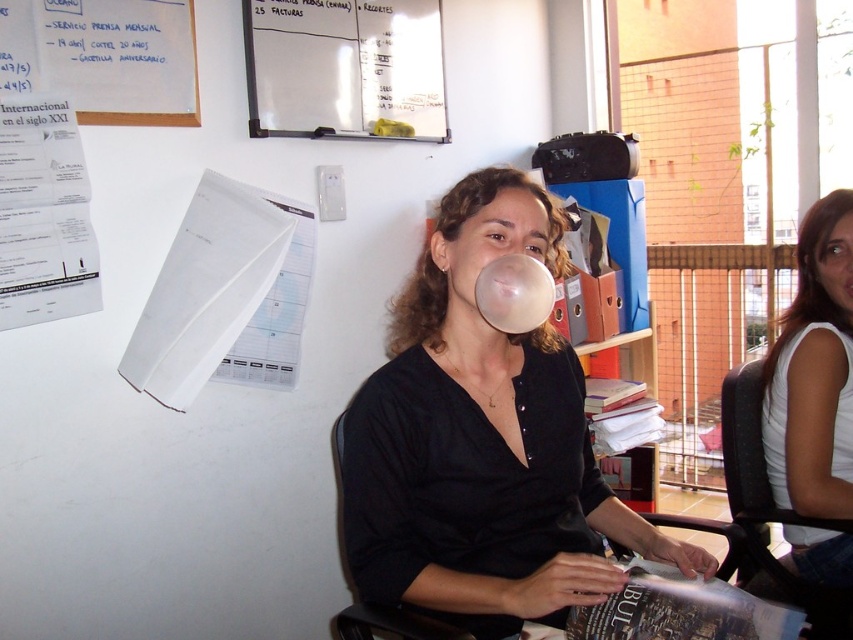
Between point (166, 42) and point (375, 625), which one is positioned behind?

The point (166, 42) is more distant.

The image size is (853, 640). In order to click on white paper at upper left in this screenshot , I will do `click(103, 58)`.

Where is `white paper at upper left`? white paper at upper left is located at coordinates (103, 58).

Between point (552, 624) and point (833, 604), which one is positioned behind?

Point (833, 604)

At what (x,y) coordinates should I click in order to perform the action: click on matte black shirt at center. Please return your answer as a coordinate pair (x, y). The image size is (853, 640). Looking at the image, I should click on (482, 442).

Which is above, matte black shirt at center or white paper at upper left?

white paper at upper left is above.

Find the location of a particular element. matte black shirt at center is located at coordinates 482,442.

Locate an element on the screen. matte black shirt at center is located at coordinates (482, 442).